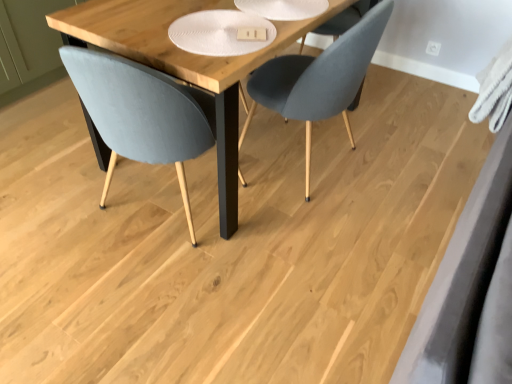
Find the location of a particular element. empty space that is to the right of matte gray chair at left, which is the second chair from right to left is located at coordinates (282, 245).